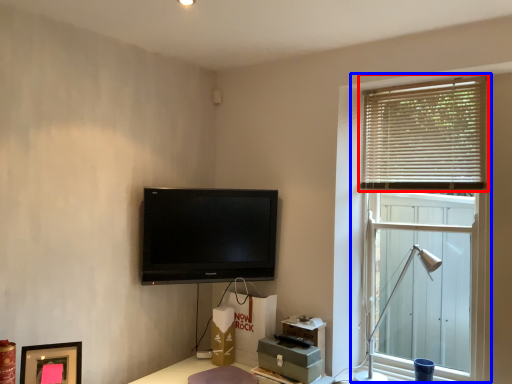
Question: Which object is closer to the camera taking this photo, window blind (highlighted by a red box) or window (highlighted by a blue box)?

Choices:
 (A) window blind
 (B) window

Answer: (B)